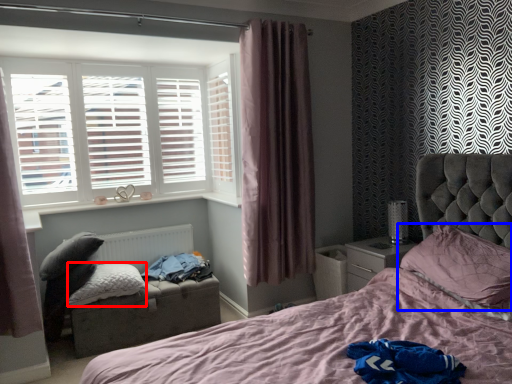
Question: Among these objects, which one is nearest to the camera, pillow (highlighted by a red box) or pillow (highlighted by a blue box)?

Choices:
 (A) pillow
 (B) pillow

Answer: (B)